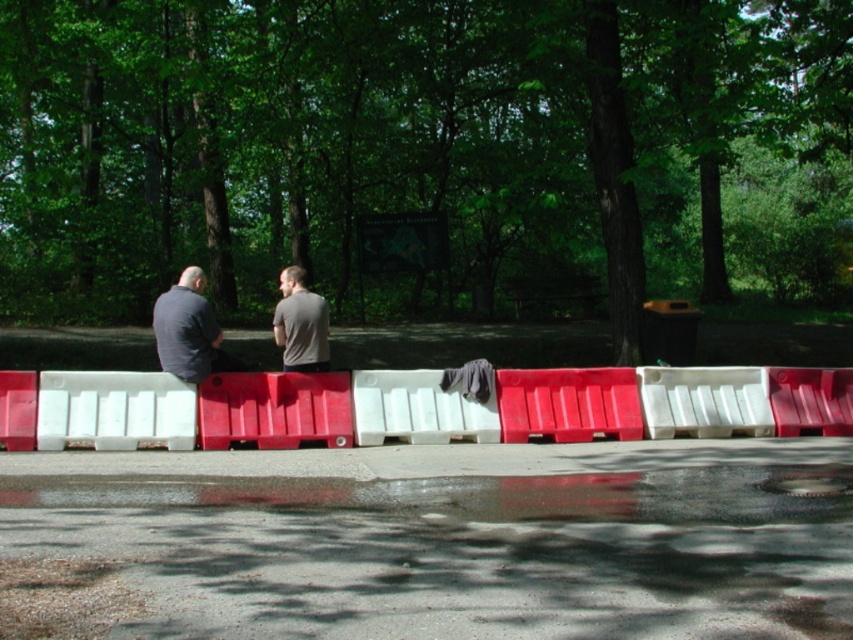
Can you confirm if white plastic barrier at center is wider than matte gray shirt at center?

Yes.

How much distance is there between white plastic barrier at center and matte gray shirt at center?

white plastic barrier at center and matte gray shirt at center are 7.31 feet apart from each other.

Is point (552, 422) in front of point (320, 301)?

No, (552, 422) is behind (320, 301).

Identify the location of white plastic barrier at center. (189, 410).

Who is higher up, dark gray shirt at left or matte gray shirt at center?

matte gray shirt at center

Between dark gray shirt at left and matte gray shirt at center, which one has more height?

With more height is dark gray shirt at left.

The height and width of the screenshot is (640, 853). Describe the element at coordinates (186, 328) in the screenshot. I see `dark gray shirt at left` at that location.

You are a GUI agent. You are given a task and a screenshot of the screen. Output one action in this format:
    pyautogui.click(x=<x>, y=<y>)
    Task: Click on the dark gray shirt at left
    This screenshot has width=853, height=640.
    Given the screenshot: What is the action you would take?
    pyautogui.click(x=186, y=328)

Can you confirm if white plastic barrier at center is positioned to the left of dark gray shirt at left?

No, white plastic barrier at center is not to the left of dark gray shirt at left.

You are a GUI agent. You are given a task and a screenshot of the screen. Output one action in this format:
    pyautogui.click(x=<x>, y=<y>)
    Task: Click on the white plastic barrier at center
    The height and width of the screenshot is (640, 853).
    Given the screenshot: What is the action you would take?
    pyautogui.click(x=189, y=410)